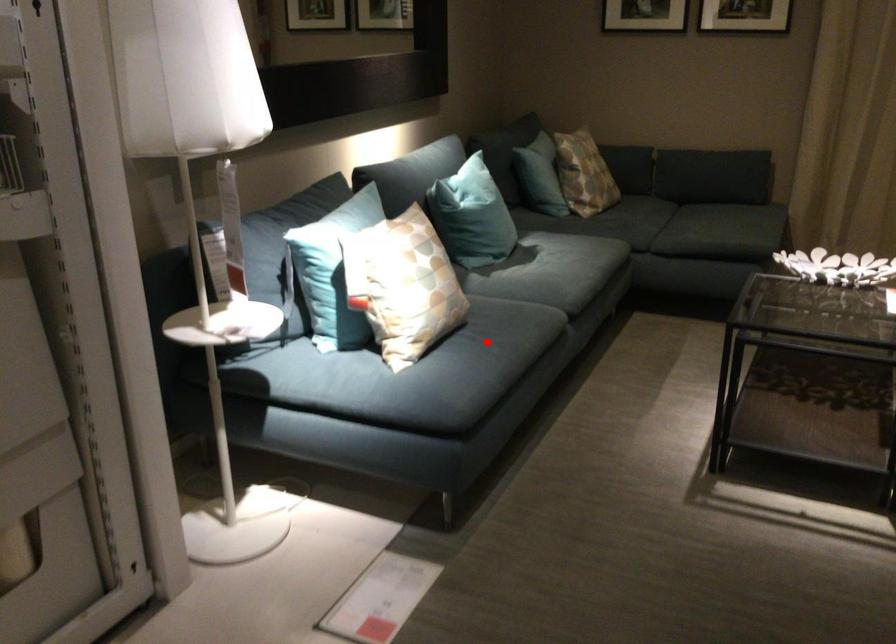
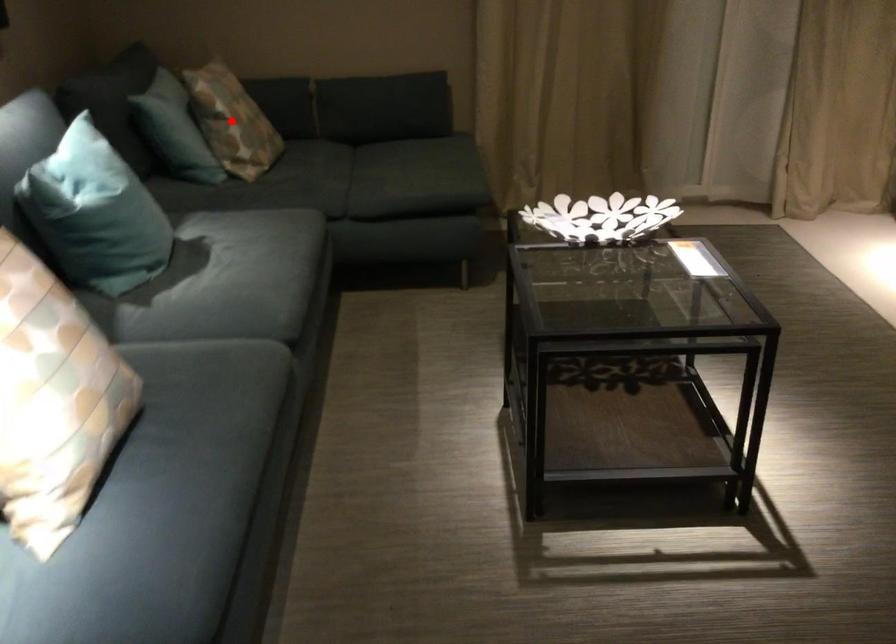
I am providing you with two images of the same scene from different viewpoints. A red point is marked on the first image and another point is marked on the second image. Are the points marked in image1 and image2 representing the same 3D position?

No